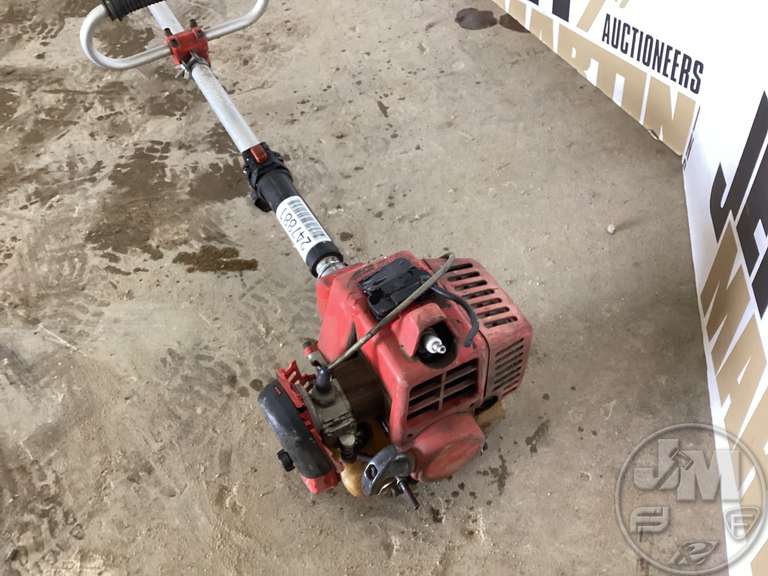
Locate an element on the screen. The height and width of the screenshot is (576, 768). pull switch is located at coordinates (385, 283).